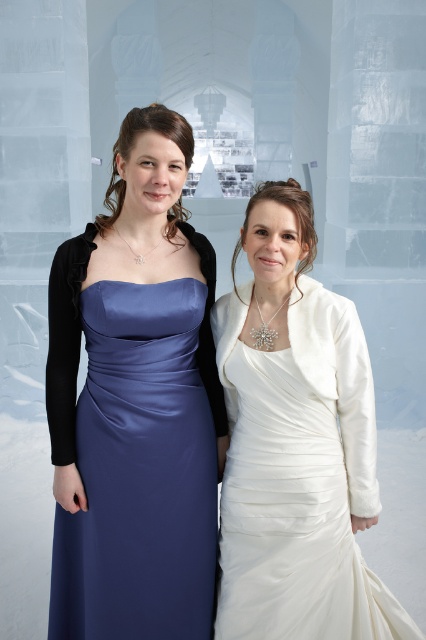
Does point (212, 298) lie behind point (316, 358)?

Yes, it is.

Between satin dress at left and white satin dress at right, which one appears on the right side from the viewer's perspective?

white satin dress at right is more to the right.

Is point (181, 577) closer to viewer compared to point (239, 346)?

Yes.

Where is `satin dress at left`? Image resolution: width=426 pixels, height=640 pixels. satin dress at left is located at coordinates (135, 428).